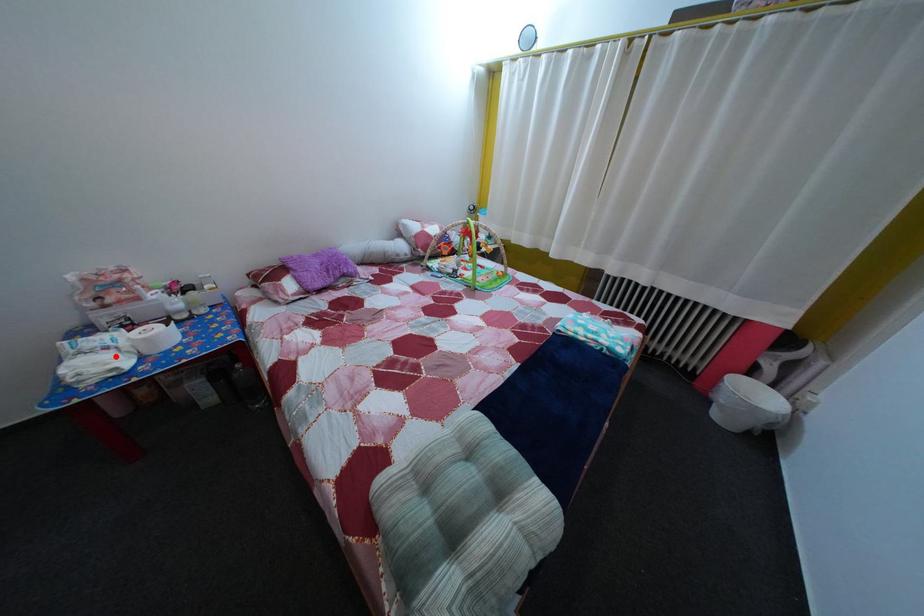
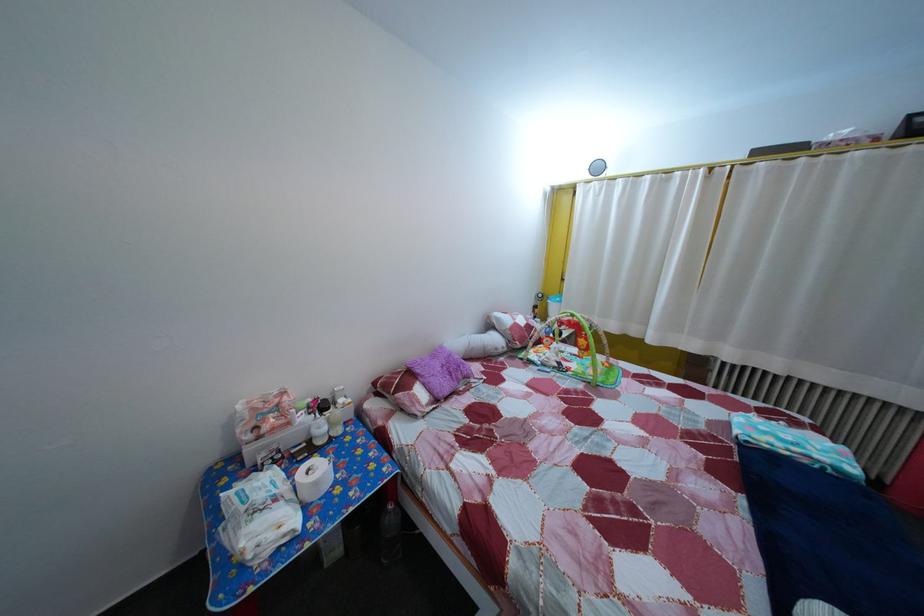
Question: I am providing you with two images of the same scene from different viewpoints. Image1 has a red point marked. In image2, the corresponding 3D location appears at what relative position? Reply with the corresponding letter.

Choices:
 (A) Closer
 (B) Farther

Answer: (A)